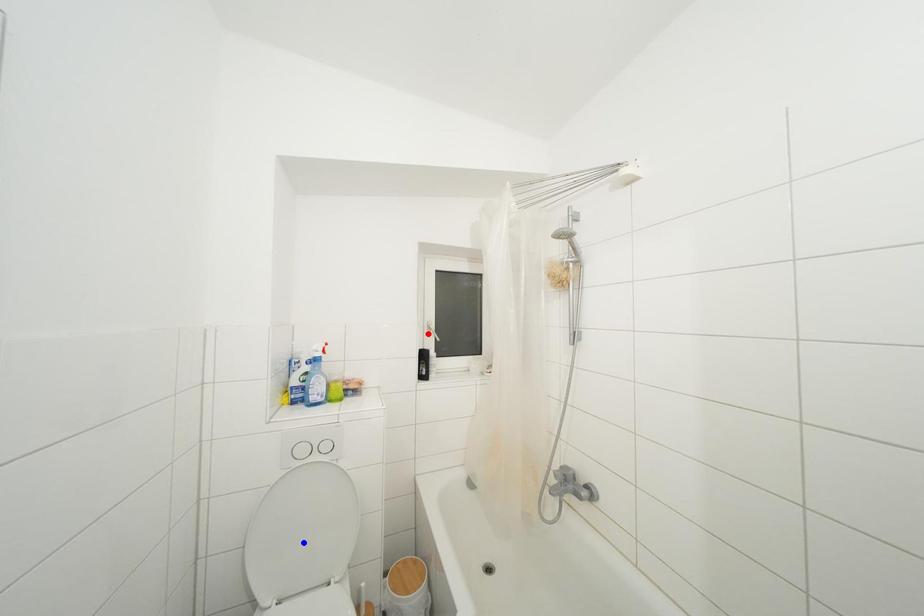
Question: In the image, two points are highlighted. Which point is nearer to the camera? Reply with the corresponding letter.

Choices:
 (A) blue point
 (B) red point

Answer: (A)